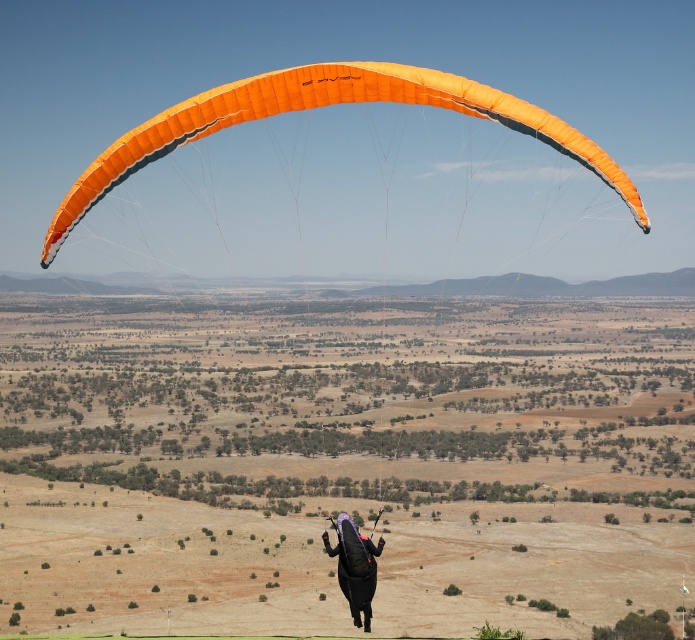
Who is positioned more to the left, orange fabric parachute at upper center or purple matte parachute at center?

purple matte parachute at center is more to the left.

Which is in front, point (528, 120) or point (343, 560)?

Positioned in front is point (528, 120).

Locate an element on the screen. The width and height of the screenshot is (695, 640). orange fabric parachute at upper center is located at coordinates (318, 106).

At what (x,y) coordinates should I click in order to perform the action: click on orange fabric parachute at upper center. Please return your answer as a coordinate pair (x, y). Looking at the image, I should click on (318, 106).